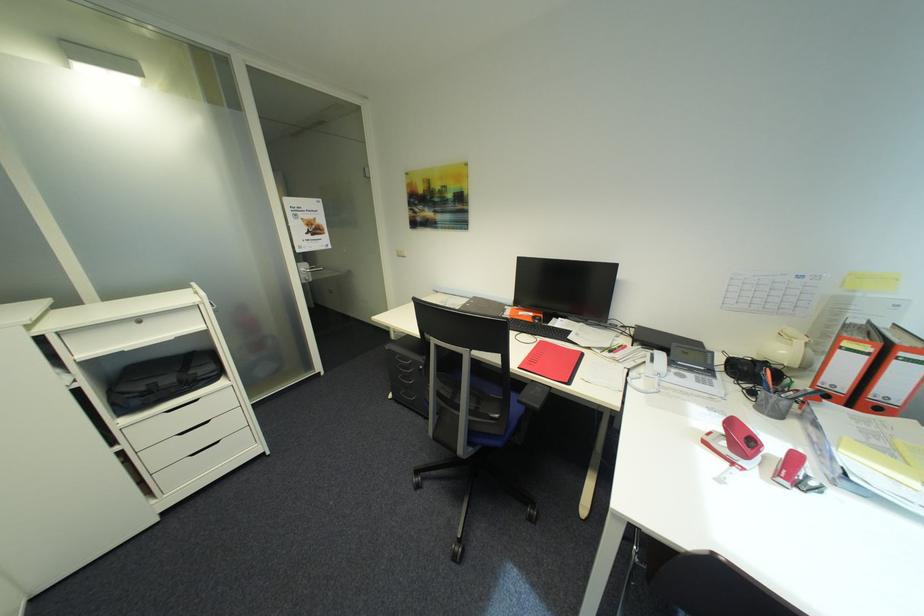
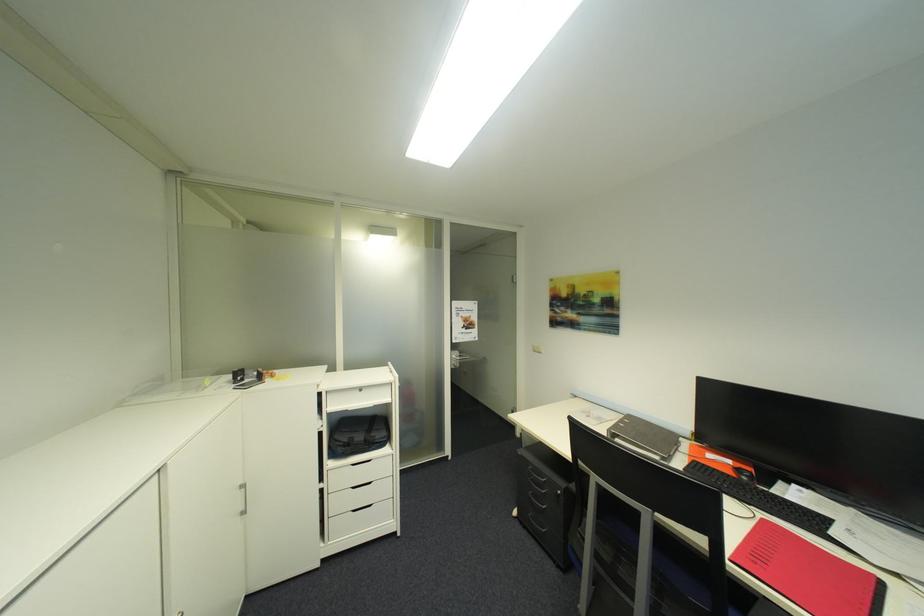
The point at (539, 315) is marked in the first image. Where is the corresponding point in the second image?

(736, 463)